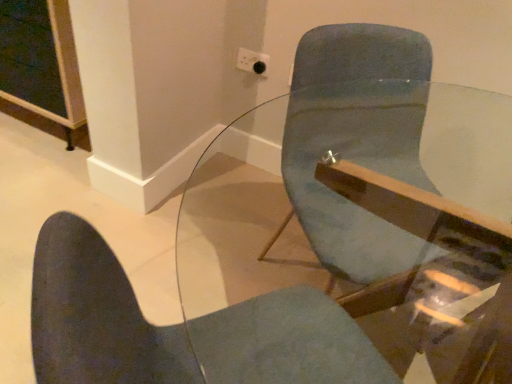
Question: From a real-world perspective, is white plastic socket at upper center under matte blue chair at center?

Choices:
 (A) yes
 (B) no

Answer: (B)

Question: Is white plastic socket at upper center to the left of matte blue chair at center from the viewer's perspective?

Choices:
 (A) no
 (B) yes

Answer: (A)

Question: Is white plastic socket at upper center positioned with its back to matte blue chair at center?

Choices:
 (A) yes
 (B) no

Answer: (B)

Question: Is white plastic socket at upper center smaller than matte blue chair at center?

Choices:
 (A) no
 (B) yes

Answer: (B)

Question: From a real-world perspective, is white plastic socket at upper center on matte blue chair at center?

Choices:
 (A) no
 (B) yes

Answer: (B)

Question: Is white plastic socket at upper center further to camera compared to matte blue chair at center?

Choices:
 (A) no
 (B) yes

Answer: (B)

Question: Is matte blue chair at center located outside white plastic socket at upper center?

Choices:
 (A) yes
 (B) no

Answer: (A)

Question: Could you tell me if matte blue chair at center is turned towards white plastic socket at upper center?

Choices:
 (A) no
 (B) yes

Answer: (A)

Question: Considering the relative sizes of matte blue chair at center and white plastic socket at upper center in the image provided, is matte blue chair at center taller than white plastic socket at upper center?

Choices:
 (A) no
 (B) yes

Answer: (A)

Question: Considering the relative sizes of matte blue chair at center and white plastic socket at upper center in the image provided, is matte blue chair at center smaller than white plastic socket at upper center?

Choices:
 (A) yes
 (B) no

Answer: (B)

Question: Considering the relative sizes of matte blue chair at center and white plastic socket at upper center in the image provided, is matte blue chair at center thinner than white plastic socket at upper center?

Choices:
 (A) yes
 (B) no

Answer: (B)

Question: From the image's perspective, is matte blue chair at center below white plastic socket at upper center?

Choices:
 (A) yes
 (B) no

Answer: (A)

Question: Is transparent glass table at center positioned before matte blue chair at center?

Choices:
 (A) yes
 (B) no

Answer: (A)